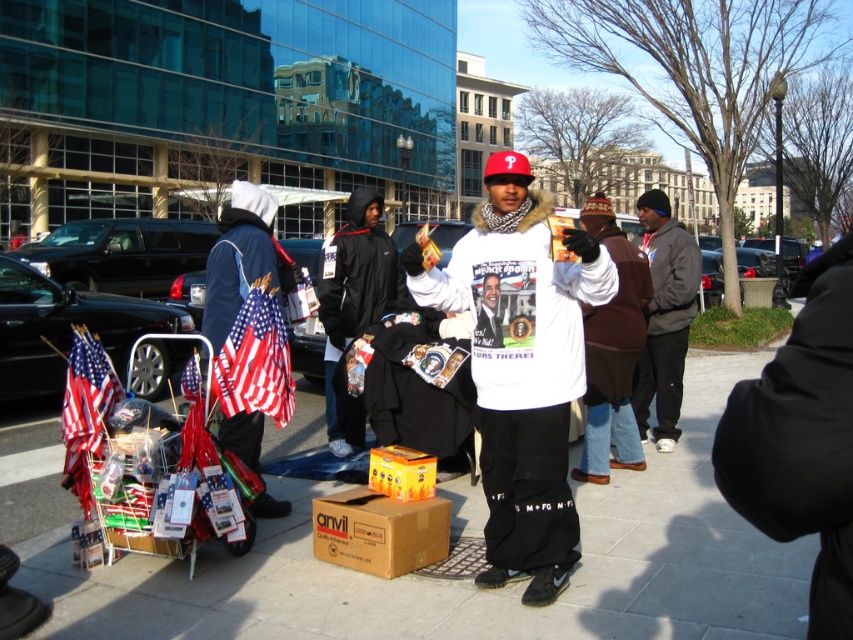
You are a photographer trying to capture the American flag at lower left without the brown fuzzy vest at center blocking it. What should you do?

The brown fuzzy vest at center is in front of the American flag at lower left, so you should move to the side to avoid the obstruction caused by the brown fuzzy vest at center.

You are a photographer taking a picture of the gray fleece jacket at center and the american flag at lower left. Based on their positions, which object is closer to the camera?

The gray fleece jacket at center is closer to the camera because it is positioned above the american flag at lower left.

You are a photographer trying to capture the entire scene of the protest. You notice the brown fuzzy vest at center and the american flag at lower left. Which object should you focus on first to ensure both are in frame without moving the camera?

The brown fuzzy vest at center has a larger size compared to the american flag at lower left, so you should focus on the brown fuzzy vest at center first to ensure both are in frame without moving the camera.